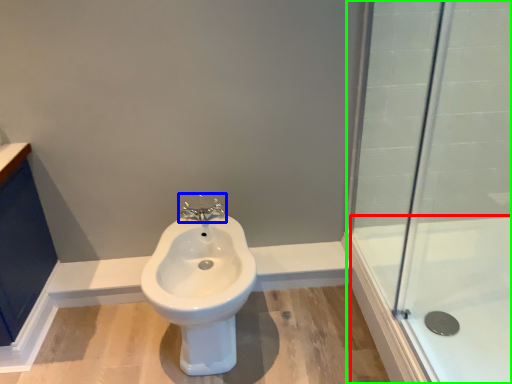
Question: Estimate the real-world distances between objects in this image. Which object is farther from bath (highlighted by a red box), tap (highlighted by a blue box) or shower door (highlighted by a green box)?

Choices:
 (A) tap
 (B) shower door

Answer: (A)